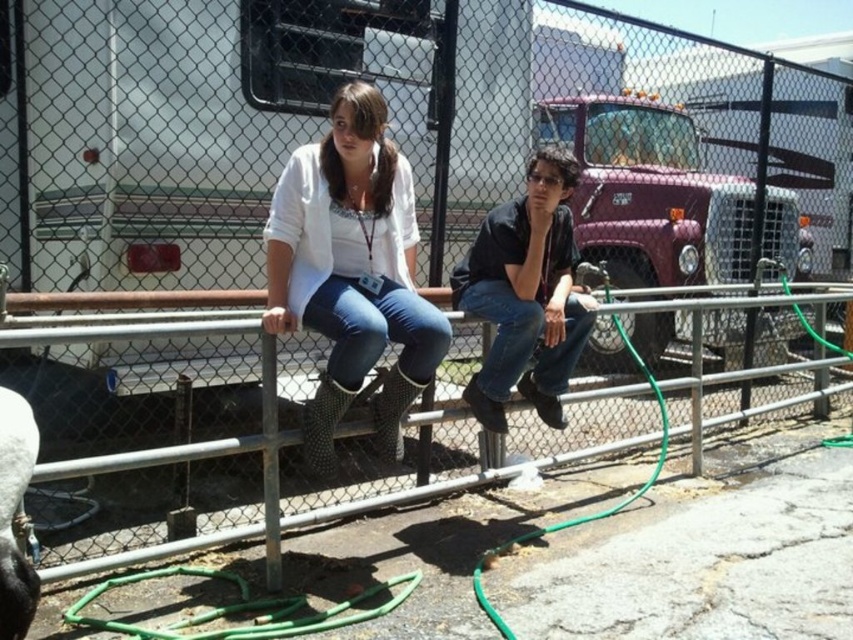
Question: Does white plastic trailer at upper left appear over white matte boots at left?

Choices:
 (A) yes
 (B) no

Answer: (A)

Question: Among these points, which one is nearest to the camera?

Choices:
 (A) (585, 220)
 (B) (399, 259)

Answer: (B)

Question: In this image, where is white plastic trailer at upper left located relative to white matte boots at left?

Choices:
 (A) right
 (B) left

Answer: (A)

Question: In this image, where is white plastic trailer at upper left located relative to white matte boots at left?

Choices:
 (A) below
 (B) above

Answer: (B)